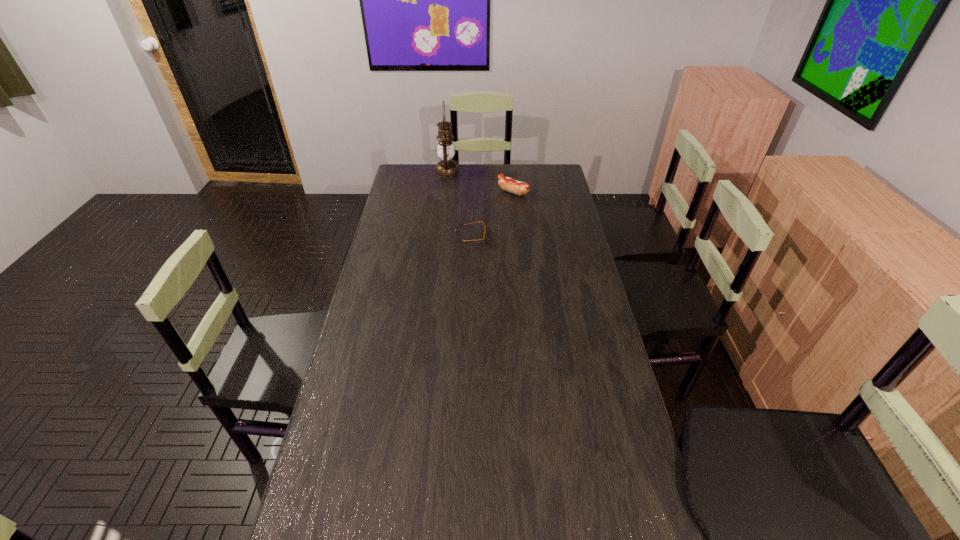
What are the coordinates of `sausage that is at the far edge` in the screenshot? It's located at (507, 184).

The height and width of the screenshot is (540, 960). In the image, there is a desktop. In order to click on vacant space at the right edge in this screenshot , I will do click(617, 471).

This screenshot has height=540, width=960. I want to click on vacant space at the far right corner of the desktop, so click(554, 183).

Where is `vacant space in between the farthest object and the second shortest object`? The width and height of the screenshot is (960, 540). vacant space in between the farthest object and the second shortest object is located at coordinates (480, 182).

Locate an element on the screen. This screenshot has width=960, height=540. vacant space that's between the leftmost object and the nearest object is located at coordinates (x=459, y=205).

This screenshot has height=540, width=960. I want to click on vacant point located between the nearest object and the second shortest object, so [492, 215].

Identify the location of vacant area between the oil lamp and the shortest object. The height and width of the screenshot is (540, 960). (459, 205).

The image size is (960, 540). What are the coordinates of `empty location between the sausage and the sunglasses` in the screenshot? It's located at (492, 215).

Identify the location of free spot between the tallest object and the shortest object. The height and width of the screenshot is (540, 960). (459, 205).

Locate an element on the screen. object that stands as the second closest to the second tallest object is located at coordinates pos(484,235).